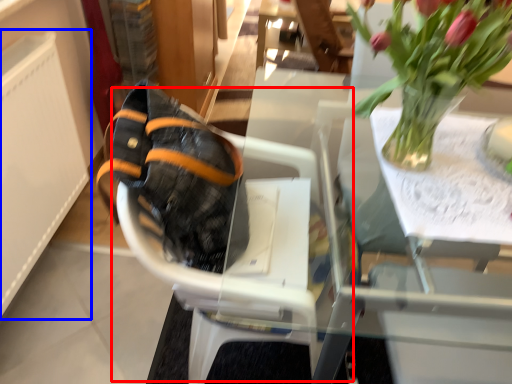
Question: Which object appears farthest to the camera in this image, baby carriage (highlighted by a red box) or radiator (highlighted by a blue box)?

Choices:
 (A) baby carriage
 (B) radiator

Answer: (B)